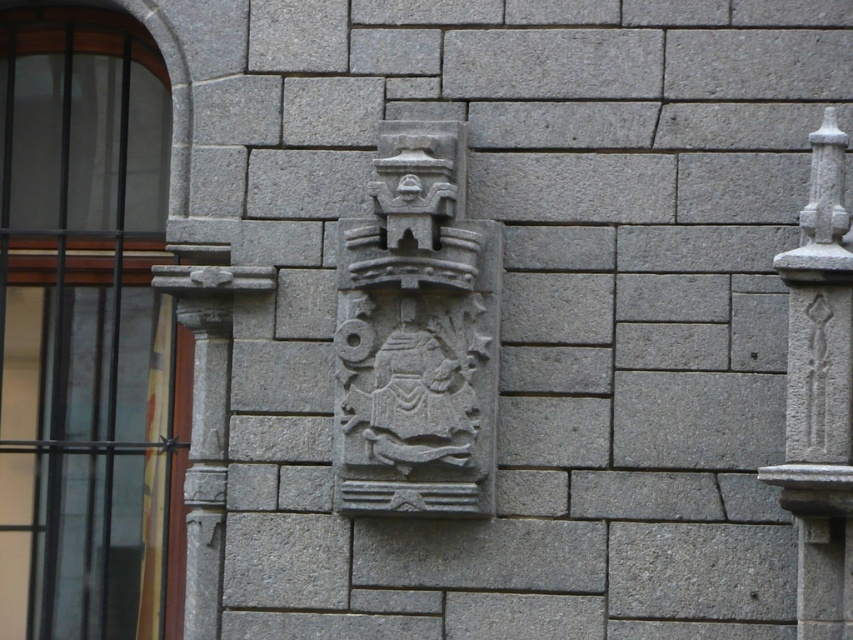
Question: Is matte glass window at center left positioned in front of gray stone crest at center?

Choices:
 (A) yes
 (B) no

Answer: (B)

Question: Which of the following is the closest to the observer?

Choices:
 (A) 15,577
 (B) 840,173

Answer: (B)

Question: Can you confirm if matte glass window at center left is smaller than gray stone crest at center?

Choices:
 (A) no
 (B) yes

Answer: (A)

Question: Which point is farther to the camera?

Choices:
 (A) (792, 486)
 (B) (338, 248)

Answer: (B)

Question: Is the position of matte glass window at center left less distant than that of gray stone crest at center?

Choices:
 (A) no
 (B) yes

Answer: (A)

Question: Which object appears closest to the camera in this image?

Choices:
 (A) matte glass window at center left
 (B) gray stone crest at center

Answer: (B)